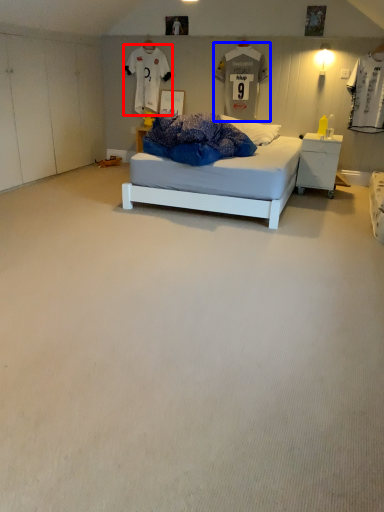
Question: Which object is closer to the camera taking this photo, t shirt (highlighted by a red box) or t shirt (highlighted by a blue box)?

Choices:
 (A) t shirt
 (B) t shirt

Answer: (B)